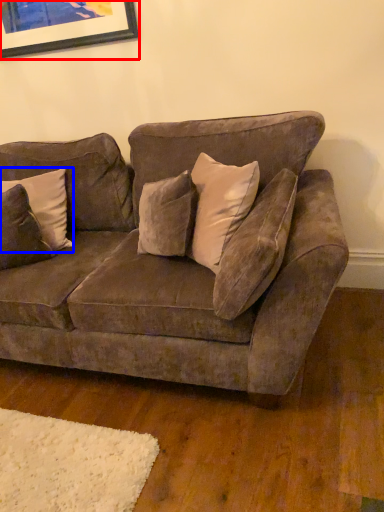
Question: Which object appears closest to the camera in this image, picture frame (highlighted by a red box) or pillow (highlighted by a blue box)?

Choices:
 (A) picture frame
 (B) pillow

Answer: (B)